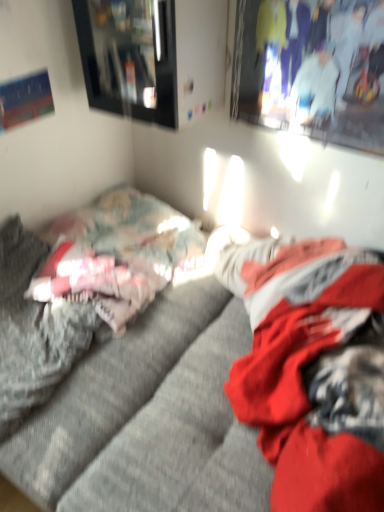
Question: Is textured gray couch at center oriented towards matte white couple at upper right?

Choices:
 (A) yes
 (B) no

Answer: (B)

Question: Considering the relative sizes of textured gray couch at center and matte white couple at upper right in the image provided, is textured gray couch at center taller than matte white couple at upper right?

Choices:
 (A) yes
 (B) no

Answer: (B)

Question: From the image's perspective, is textured gray couch at center on top of matte white couple at upper right?

Choices:
 (A) no
 (B) yes

Answer: (A)

Question: Does textured gray couch at center have a larger size compared to matte white couple at upper right?

Choices:
 (A) yes
 (B) no

Answer: (A)

Question: Is textured gray couch at center smaller than matte white couple at upper right?

Choices:
 (A) no
 (B) yes

Answer: (A)

Question: Is textured gray couch at center inside or outside of matte black picture frame at upper left?

Choices:
 (A) outside
 (B) inside

Answer: (A)

Question: Looking at their shapes, would you say textured gray couch at center is wider or thinner than matte black picture frame at upper left?

Choices:
 (A) thin
 (B) wide

Answer: (B)

Question: From the image's perspective, is textured gray couch at center positioned above or below matte black picture frame at upper left?

Choices:
 (A) below
 (B) above

Answer: (A)

Question: Does point (168, 226) appear closer or farther from the camera than point (77, 13)?

Choices:
 (A) farther
 (B) closer

Answer: (A)

Question: Is fluffy gray bed at left wider or thinner than textured gray couch at center?

Choices:
 (A) thin
 (B) wide

Answer: (A)

Question: From a real-world perspective, is fluffy gray bed at left above or below textured gray couch at center?

Choices:
 (A) above
 (B) below

Answer: (B)

Question: Considering the relative positions of fluffy gray bed at left and textured gray couch at center in the image provided, is fluffy gray bed at left to the left or to the right of textured gray couch at center?

Choices:
 (A) right
 (B) left

Answer: (B)

Question: Is fluffy gray bed at left spatially inside textured gray couch at center, or outside of it?

Choices:
 (A) outside
 (B) inside

Answer: (A)

Question: Based on their positions, is textured gray couch at center located to the left or right of fluffy gray bed at left?

Choices:
 (A) left
 (B) right

Answer: (B)

Question: Is textured gray couch at center taller or shorter than fluffy gray bed at left?

Choices:
 (A) tall
 (B) short

Answer: (B)